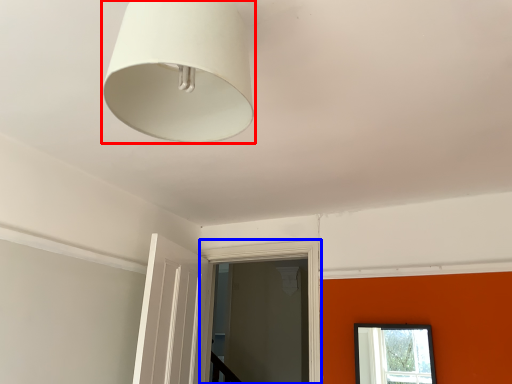
Question: Which object appears farthest to the camera in this image, lamp (highlighted by a red box) or window frame (highlighted by a blue box)?

Choices:
 (A) lamp
 (B) window frame

Answer: (B)